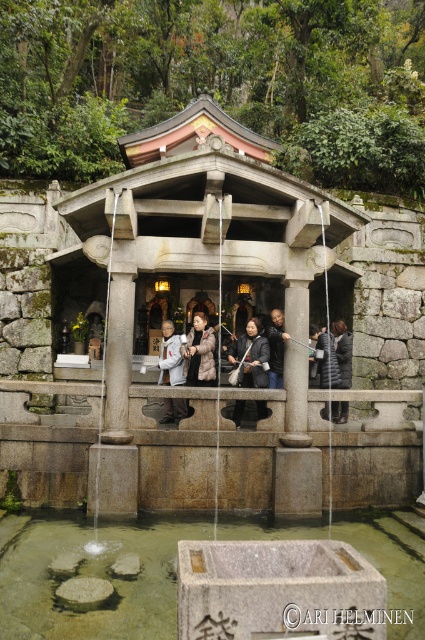
You are standing at the entrance of the shrine and want to locate the dark gray stone person at center. According to the coordinates provided, where should you look relative to the center of the image?

The dark gray stone person at center is located at coordinates point (x=170, y=356), which is slightly to the right and slightly below the center of the image.

You are a visitor at the shrine and want to place your dark gray down jacket at center near the transparent stone water at center. Considering the distance between them, can you comfortably walk from the jacket to the water without any obstacles?

The distance between the transparent stone water at center and the dark gray down jacket at center is 17.21 feet. Since this distance is more than sufficient for comfortable walking, you can easily walk from the jacket to the water without any obstacles.